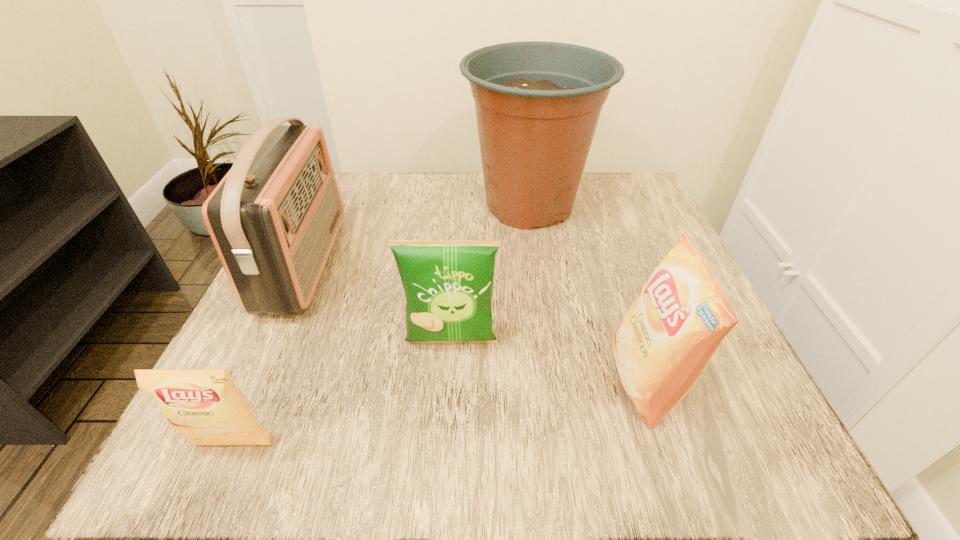
Where is `empty space between the flowerpot and the leftmost crisp (potato chip)`? The height and width of the screenshot is (540, 960). empty space between the flowerpot and the leftmost crisp (potato chip) is located at coordinates (381, 325).

This screenshot has width=960, height=540. In order to click on free spot between the second crisp (potato chip) from right to left and the second tallest object in this screenshot , I will do `click(377, 303)`.

Identify the location of empty location between the flowerpot and the second tallest object. The image size is (960, 540). (417, 234).

Find the location of a particular element. This screenshot has height=540, width=960. empty location between the flowerpot and the rightmost crisp (potato chip) is located at coordinates (588, 293).

The image size is (960, 540). Find the location of `free area in between the flowerpot and the shortest object`. free area in between the flowerpot and the shortest object is located at coordinates (381, 325).

Locate which object is the third closest to the nearest crisp (potato chip). Please provide its 2D coordinates. Your answer should be formatted as a tuple, i.e. [(x, y)], where the tuple contains the x and y coordinates of a point satisfying the conditions above.

[(537, 104)]

Select which object is the second closest to the radio receiver. Please provide its 2D coordinates. Your answer should be formatted as a tuple, i.e. [(x, y)], where the tuple contains the x and y coordinates of a point satisfying the conditions above.

[(206, 406)]

Identify which crisp (potato chip) is the second closest to the rightmost crisp (potato chip). Please provide its 2D coordinates. Your answer should be formatted as a tuple, i.e. [(x, y)], where the tuple contains the x and y coordinates of a point satisfying the conditions above.

[(206, 406)]

Choose which crisp (potato chip) is the third nearest neighbor to the fourth shortest object. Please provide its 2D coordinates. Your answer should be formatted as a tuple, i.e. [(x, y)], where the tuple contains the x and y coordinates of a point satisfying the conditions above.

[(664, 342)]

In order to click on vacant point that satisfies the following two spatial constraints: 1. on the front-facing side of the rightmost crisp (potato chip); 2. on the front of the nearest object with the logo in this screenshot , I will do `click(666, 445)`.